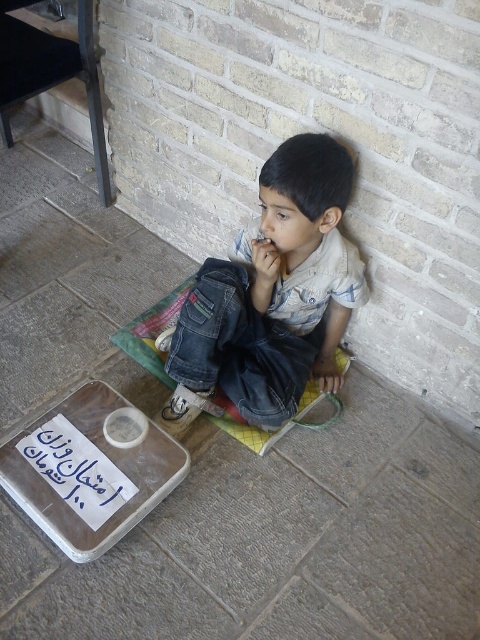
Is denim jeans at center below transparent plastic tray at lower left?

No, denim jeans at center is not below transparent plastic tray at lower left.

Is point (324, 268) positioned behind point (84, 435)?

That is True.

The height and width of the screenshot is (640, 480). I want to click on denim jeans at center, so click(277, 291).

Does denim jeans at center appear on the right side of green woven mat at center?

Indeed, denim jeans at center is positioned on the right side of green woven mat at center.

Does point (324, 220) come in front of point (260, 435)?

Yes, it is in front of point (260, 435).

Is point (333, 340) in front of point (236, 419)?

No.

The width and height of the screenshot is (480, 640). Find the location of `denim jeans at center`. denim jeans at center is located at coordinates (277, 291).

The image size is (480, 640). I want to click on transparent plastic tray at lower left, so click(90, 470).